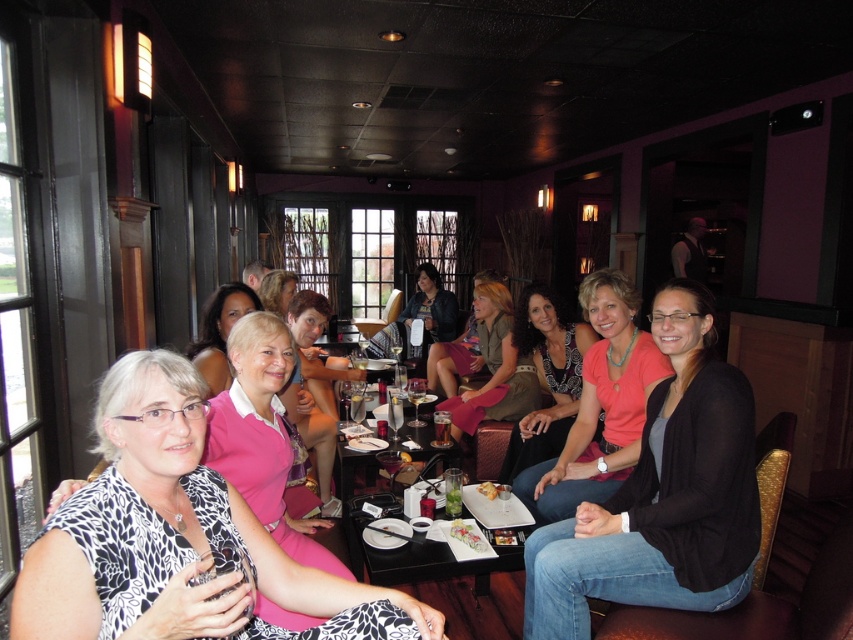
Question: Is printed fabric dress at center positioned behind clear glass martini at center?

Choices:
 (A) no
 (B) yes

Answer: (A)

Question: Is matte black jacket at center wider than clear glass martini at center?

Choices:
 (A) no
 (B) yes

Answer: (B)

Question: Which point is closer to the camera?

Choices:
 (A) (535, 484)
 (B) (204, 368)
 (C) (283, 310)
 (D) (322, 426)

Answer: (B)

Question: Which of the following is the farthest from the observer?

Choices:
 (A) (590, 448)
 (B) (473, 534)

Answer: (A)

Question: In this image, where is matte black jacket at center located relative to clear glass martini at center?

Choices:
 (A) left
 (B) right

Answer: (A)

Question: Which of the following is the closest to the observer?

Choices:
 (A) pink matte shirt at center
 (B) matte black jacket at center
 (C) pink fabric dress at center
 (D) matte black top at center

Answer: (A)